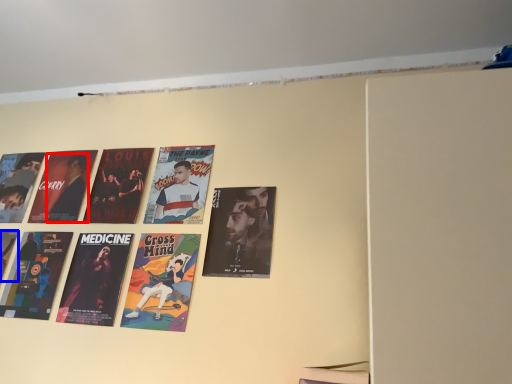
Question: Which of the following is the farthest to the observer, person (highlighted by a red box) or poster (highlighted by a blue box)?

Choices:
 (A) person
 (B) poster

Answer: (A)